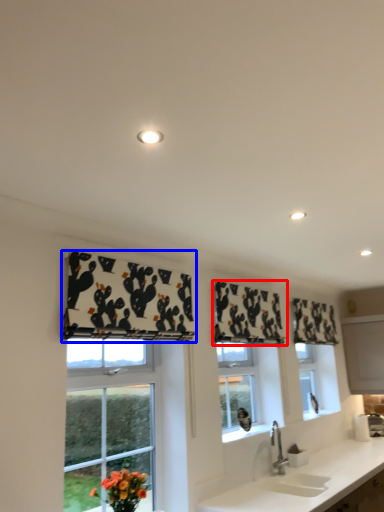
Question: Which of the following is the farthest to the observer, curtain (highlighted by a red box) or curtain (highlighted by a blue box)?

Choices:
 (A) curtain
 (B) curtain

Answer: (A)